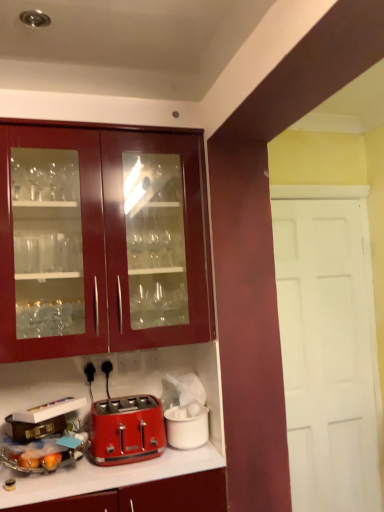
Question: Is white matte ice bucket at lower center, which ranks as the 1th appliance in right-to-left order, bigger or smaller than shiny red toaster at lower center?

Choices:
 (A) small
 (B) big

Answer: (A)

Question: Does point (168, 415) appear closer or farther from the camera than point (107, 444)?

Choices:
 (A) farther
 (B) closer

Answer: (A)

Question: Which of these objects is positioned farthest from the glossy wood cabinet at upper left?

Choices:
 (A) brown leather suitcase at lower left, placed as the 3th appliance when sorted from right to left
 (B) shiny red toaster at lower center
 (C) matte red toaster at lower left, which is the second appliance from right to left
 (D) white matte ice bucket at lower center, which ranks as the 1th appliance in right-to-left order

Answer: (A)

Question: Which object is positioned closest to the glossy wood cabinet at upper left?

Choices:
 (A) white matte ice bucket at lower center, which ranks as the 1th appliance in right-to-left order
 (B) shiny red toaster at lower center
 (C) brown leather suitcase at lower left, placed as the 3th appliance when sorted from right to left
 (D) matte red toaster at lower left, which is the second appliance from right to left

Answer: (B)